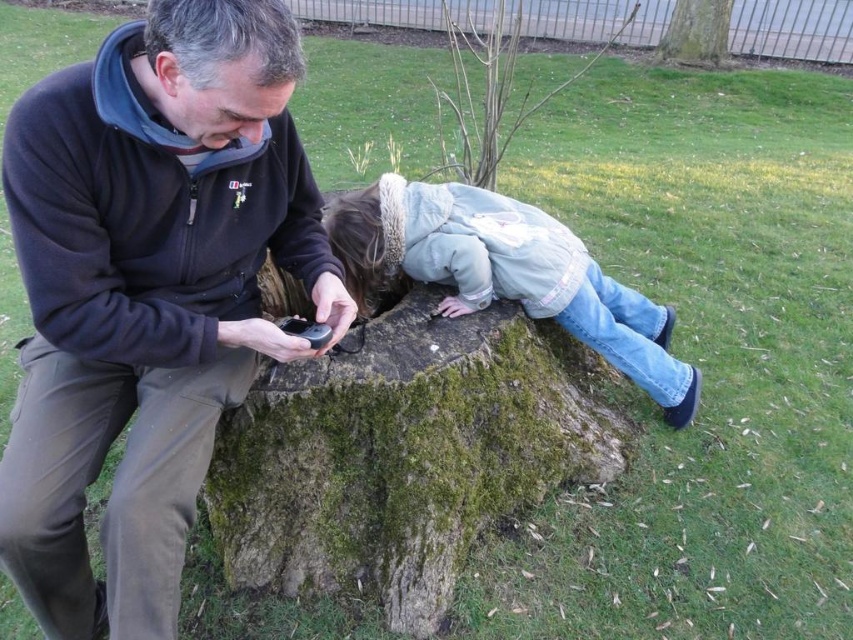
Which of these two, dark blue fleece at upper left or brown rough tree trunk at upper center, stands taller?

Standing taller between the two is dark blue fleece at upper left.

Between point (115, 584) and point (680, 51), which one is positioned in front?

Point (115, 584) is more forward.

Which is behind, point (109, 177) or point (683, 29)?

Positioned behind is point (683, 29).

I want to click on dark blue fleece at upper left, so click(148, 292).

Consider the image. Does dark blue fleece at upper left have a lesser height compared to light blue denim jeans at center?

No, dark blue fleece at upper left is not shorter than light blue denim jeans at center.

Does dark blue fleece at upper left have a lesser width compared to light blue denim jeans at center?

Correct, dark blue fleece at upper left's width is less than light blue denim jeans at center's.

I want to click on dark blue fleece at upper left, so click(148, 292).

Which of these two, green mossy stump at center or light blue denim jeans at center, stands shorter?

light blue denim jeans at center

The height and width of the screenshot is (640, 853). What do you see at coordinates (404, 454) in the screenshot?
I see `green mossy stump at center` at bounding box center [404, 454].

Measure the distance between point (x=461, y=326) and camera.

A distance of 2.42 meters exists between point (x=461, y=326) and camera.

The height and width of the screenshot is (640, 853). Find the location of `green mossy stump at center`. green mossy stump at center is located at coordinates (404, 454).